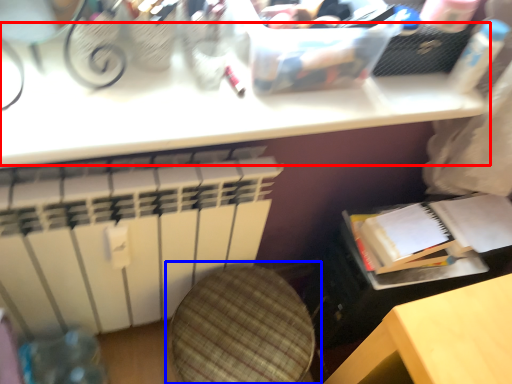
Question: Which object appears farthest to the camera in this image, table (highlighted by a red box) or swivel chair (highlighted by a blue box)?

Choices:
 (A) table
 (B) swivel chair

Answer: (B)